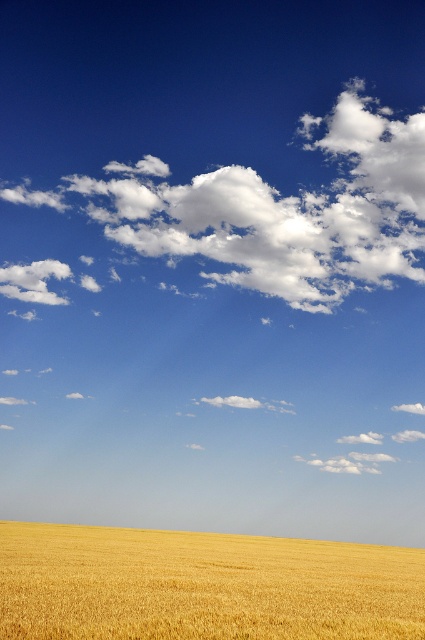
Question: Observing the image, what is the correct spatial positioning of white fluffy cloud at upper center in reference to golden matte wheat field at bottom?

Choices:
 (A) below
 (B) above

Answer: (B)

Question: Is white fluffy cloud at upper center wider than golden matte wheat field at bottom?

Choices:
 (A) yes
 (B) no

Answer: (A)

Question: Can you confirm if white fluffy cloud at upper center is wider than golden matte wheat field at bottom?

Choices:
 (A) yes
 (B) no

Answer: (A)